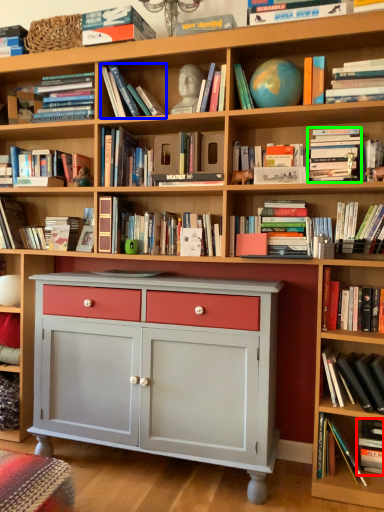
Question: Estimate the real-world distances between objects in this image. Which object is farther from book (highlighted by a red box), book (highlighted by a blue box) or book (highlighted by a green box)?

Choices:
 (A) book
 (B) book

Answer: (A)